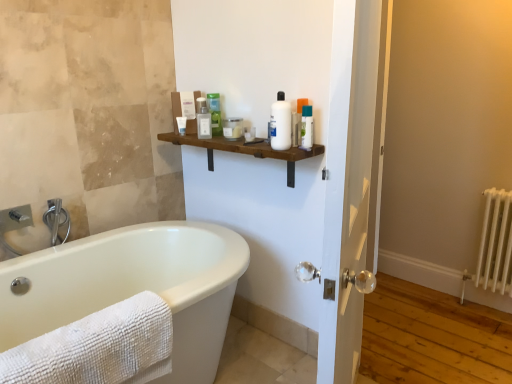
Identify the location of vacant space situated on the left part of white metallic radiator at right. The width and height of the screenshot is (512, 384). (452, 317).